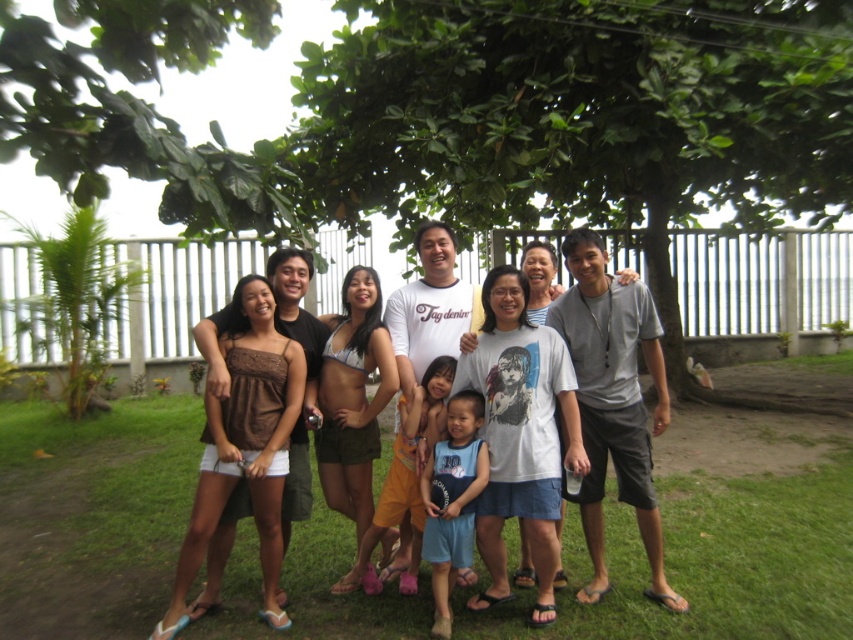
Question: Considering the relative positions of brown fabric dress at left and blue cotton shorts at center in the image provided, where is brown fabric dress at left located with respect to blue cotton shorts at center?

Choices:
 (A) below
 (B) above

Answer: (B)

Question: Observing the image, what is the correct spatial positioning of matte brown dress at center in reference to brown fabric dress at left?

Choices:
 (A) above
 (B) below

Answer: (A)

Question: Which object is the farthest from the green leafy tree at center?

Choices:
 (A) matte brown dress at center
 (B) orange cotton shorts at center
 (C) green grass at center

Answer: (C)

Question: Is matte brown dress at center positioned behind blue cotton shorts at center?

Choices:
 (A) no
 (B) yes

Answer: (B)

Question: Which point is closer to the camera?

Choices:
 (A) (831, 532)
 (B) (592, 593)

Answer: (B)

Question: Which of the following is the closest to the observer?

Choices:
 (A) matte brown dress at center
 (B) gray cotton t-shirt at center
 (C) green grass at center
 (D) blue cotton shorts at center

Answer: (C)